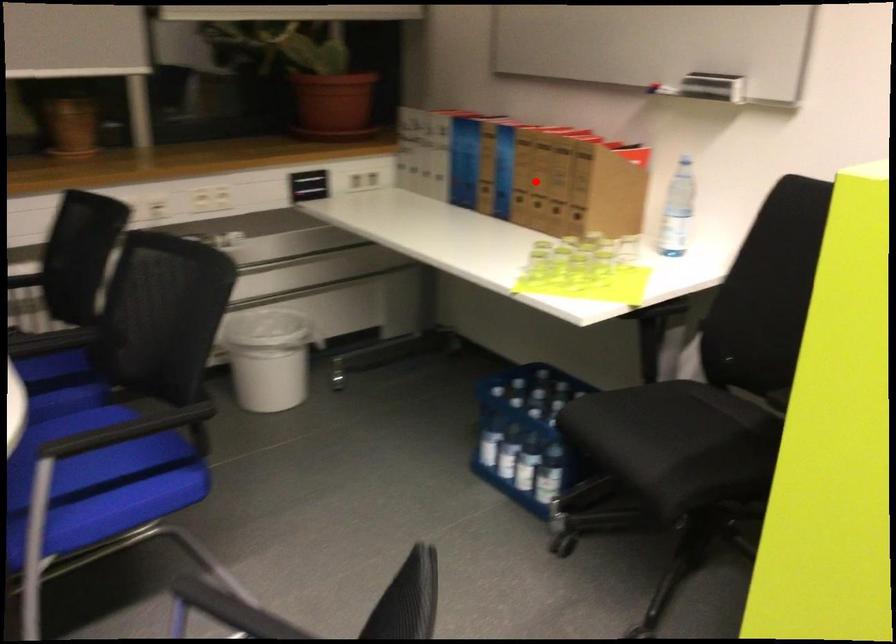
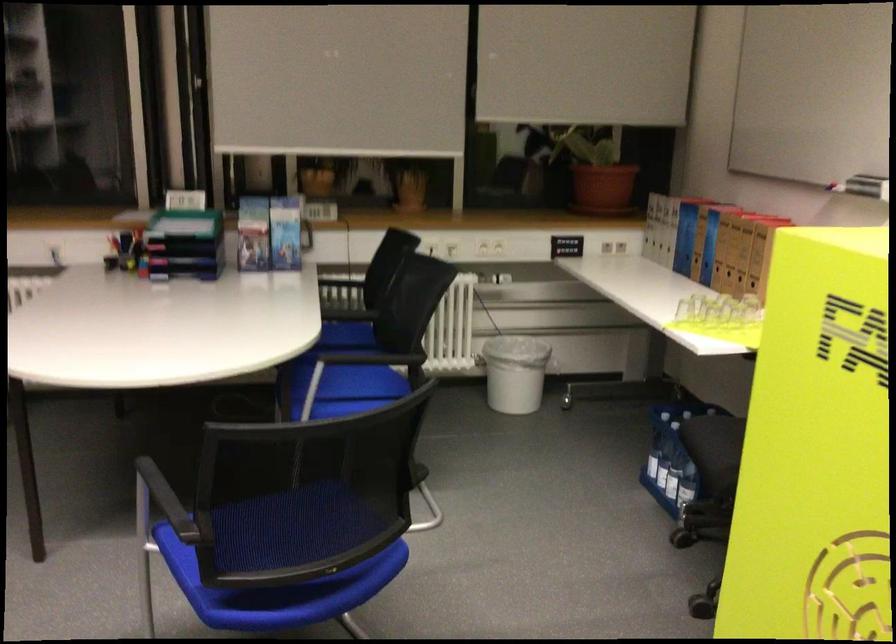
Question: I am providing you with two images of the same scene from different viewpoints. A red point is shown in image1. For the corresponding object point in image2, is it positioned nearer or farther from the camera?

Choices:
 (A) Nearer
 (B) Farther

Answer: (B)